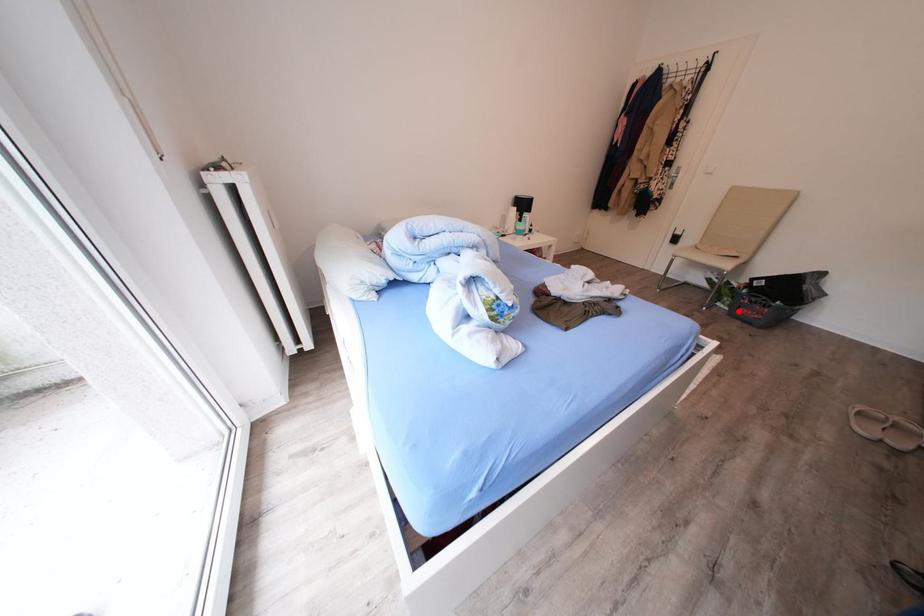
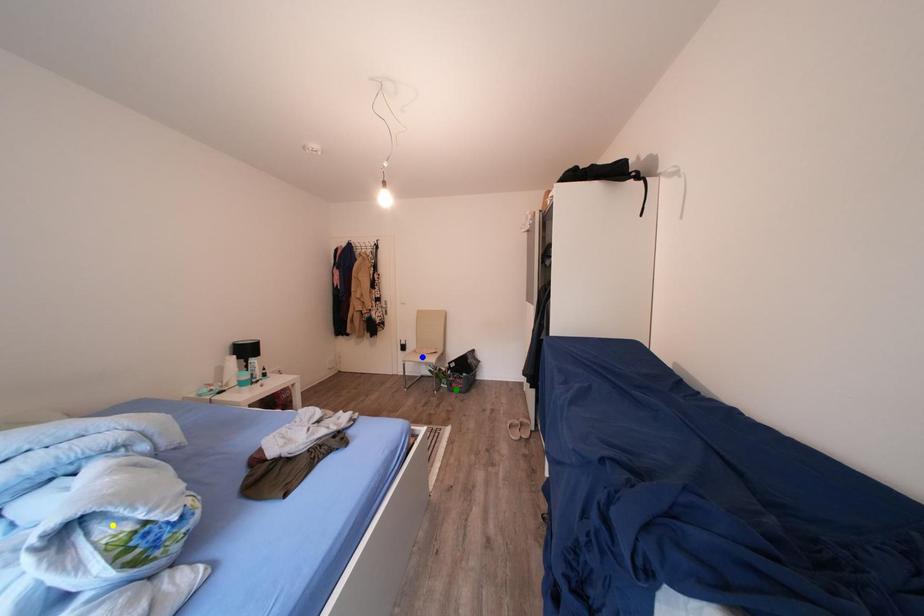
Question: I am providing you with two images of the same scene from different viewpoints. A red point is marked on the first image. You are given multiple points on the second image. In image 2, which mark is for the same physical point as the one in image 1?

Choices:
 (A) blue point
 (B) green point
 (C) yellow point

Answer: (B)